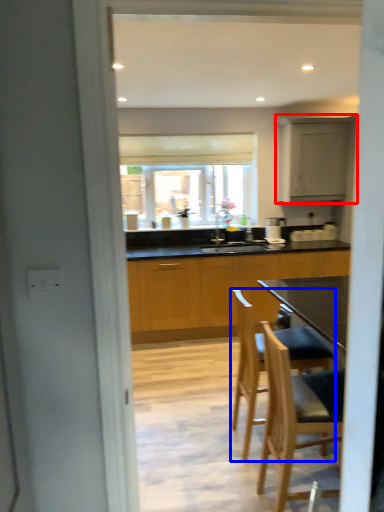
Question: Which object appears closest to the camera in this image, cabinetry (highlighted by a red box) or chair (highlighted by a blue box)?

Choices:
 (A) cabinetry
 (B) chair

Answer: (B)